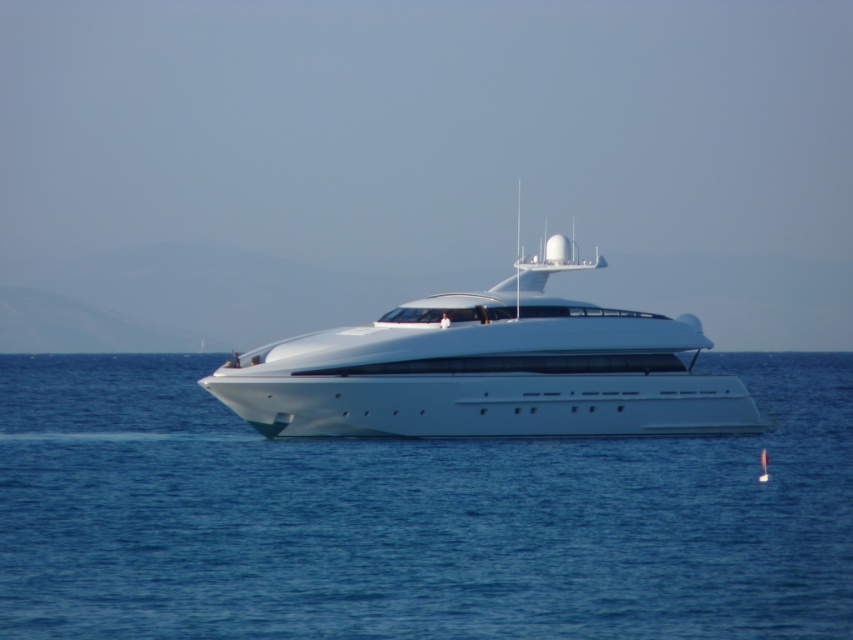
You are a sailor on a boat and you see the white glossy water at center and the white glossy yacht at center. Which one is closer to you?

The white glossy water at center is closer to you because it is in front of the white glossy yacht at center.

You are a photographer on a nearby boat and want to capture the white glossy yacht at center and the white glossy water at center in a single shot. Considering their sizes, which object will occupy more of the frame?

The white glossy water at center is larger in size than the white glossy yacht at center, so it will occupy more of the frame.